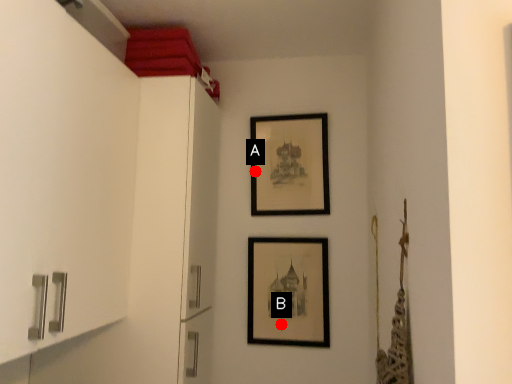
Question: Two points are circled on the image, labeled by A and B beside each circle. Among these points, which one is farthest from the camera?

Choices:
 (A) A is further
 (B) B is further

Answer: (A)